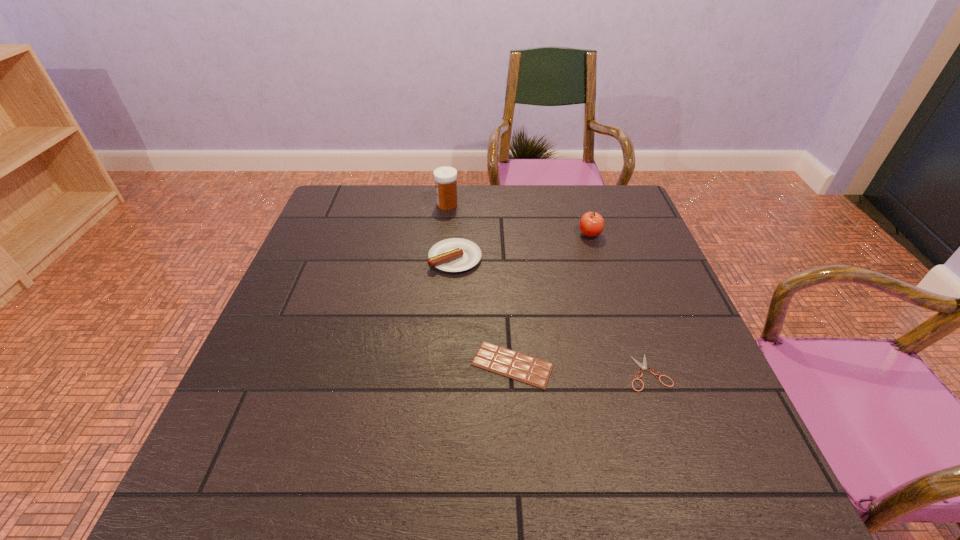
Image resolution: width=960 pixels, height=540 pixels. Find the location of `the farthest object`. the farthest object is located at coordinates (445, 177).

At what (x,y) coordinates should I click in order to perform the action: click on the tallest object. Please return your answer as a coordinate pair (x, y). Looking at the image, I should click on pos(445,177).

The image size is (960, 540). In order to click on the fourth shortest object in this screenshot , I will do `click(591, 224)`.

This screenshot has width=960, height=540. Identify the location of the fourth nearest object. (591, 224).

Where is `the third shortest object`? the third shortest object is located at coordinates click(x=455, y=254).

The width and height of the screenshot is (960, 540). I want to click on the third nearest object, so click(x=455, y=254).

Identify the location of the fourth tallest object. (512, 364).

Locate an element on the screen. the shortest object is located at coordinates (643, 366).

This screenshot has height=540, width=960. I want to click on vacant space located on the left of the farthest object, so click(x=401, y=205).

What are the coordinates of `free point located on the back of the apple` in the screenshot? It's located at [583, 211].